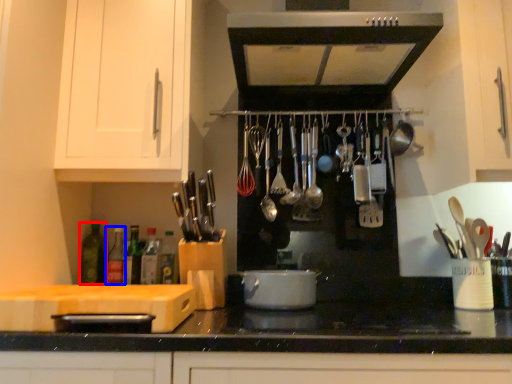
Question: Among these objects, which one is farthest to the camera, bottle (highlighted by a red box) or bottle (highlighted by a blue box)?

Choices:
 (A) bottle
 (B) bottle

Answer: (B)